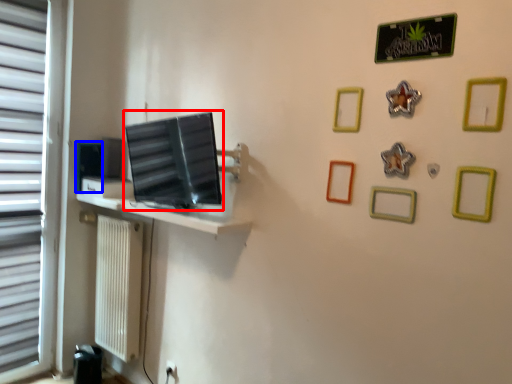
Question: Which point is closer to the camera, computer monitor (highlighted by a red box) or picture frame (highlighted by a blue box)?

Choices:
 (A) computer monitor
 (B) picture frame

Answer: (A)